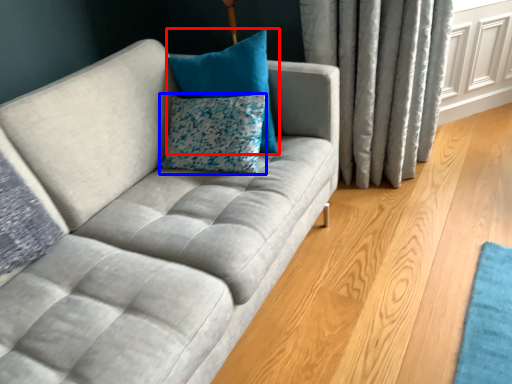
Question: Which point is closer to the camera, pillow (highlighted by a red box) or pillow (highlighted by a blue box)?

Choices:
 (A) pillow
 (B) pillow

Answer: (A)